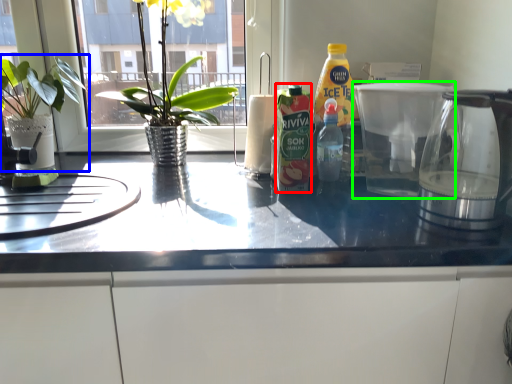
Question: Which is nearer to the bottle (highlighted by a red box)? houseplant (highlighted by a blue box) or coffeepot (highlighted by a green box).

Choices:
 (A) houseplant
 (B) coffeepot

Answer: (B)